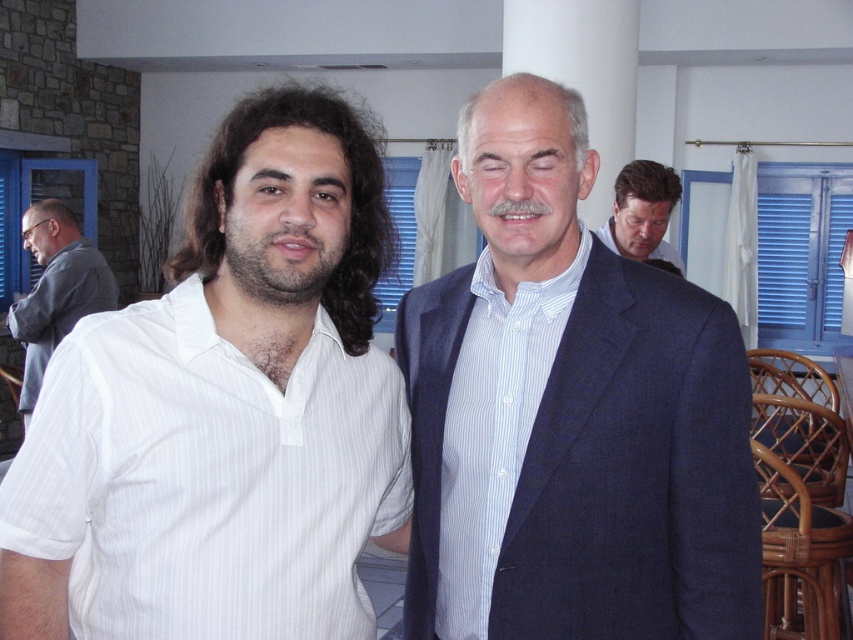
What do you see at coordinates (596, 465) in the screenshot?
I see `blue suit at center` at bounding box center [596, 465].

Who is higher up, blue suit at center or white striped shirt at center?

Positioned higher is blue suit at center.

What do you see at coordinates (596, 465) in the screenshot? Image resolution: width=853 pixels, height=640 pixels. I see `blue suit at center` at bounding box center [596, 465].

Where is `blue suit at center`? The image size is (853, 640). blue suit at center is located at coordinates (596, 465).

Is white striped shirt at center bigger than gray fabric shirt at left?

No, white striped shirt at center is not bigger than gray fabric shirt at left.

The image size is (853, 640). What do you see at coordinates (492, 429) in the screenshot?
I see `white striped shirt at center` at bounding box center [492, 429].

What are the coordinates of `white striped shirt at center` in the screenshot? It's located at (492, 429).

Can you confirm if white striped shirt at left is positioned to the left of blue suit at upper right?

Yes, white striped shirt at left is to the left of blue suit at upper right.

Between white striped shirt at left and blue suit at upper right, which one is positioned lower?

white striped shirt at left

Measure the distance between white striped shirt at left and camera.

A distance of 1.03 meters exists between white striped shirt at left and camera.

I want to click on white striped shirt at left, so click(x=207, y=477).